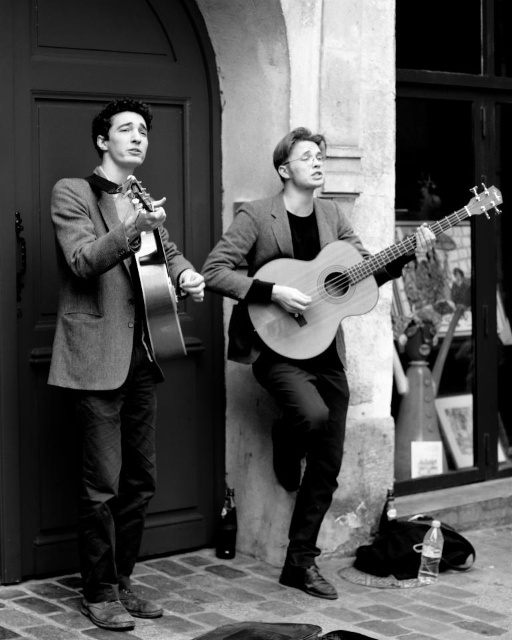
Is point (101, 262) more distant than point (146, 241)?

No.

In the scene shown: Is matte gray blazer at left shorter than matte acoustic guitar at center?

In fact, matte gray blazer at left may be taller than matte acoustic guitar at center.

Does point (147, 371) come closer to viewer compared to point (165, 296)?

That is False.

In order to click on matte gray blazer at left in this screenshot , I will do `click(111, 356)`.

Is wooden acoustic guitar at center positioned behind matte acoustic guitar at center?

Yes.

Does wooden acoustic guitar at center have a greater width compared to matte acoustic guitar at center?

Indeed, wooden acoustic guitar at center has a greater width compared to matte acoustic guitar at center.

This screenshot has height=640, width=512. Identify the location of wooden acoustic guitar at center. (321, 296).

You are a GUI agent. You are given a task and a screenshot of the screen. Output one action in this format:
    pyautogui.click(x=<x>, y=<y>)
    Task: Click on the wooden acoustic guitar at center
    This screenshot has height=640, width=512.
    Given the screenshot: What is the action you would take?
    pyautogui.click(x=321, y=296)

Which is more to the right, matte wood guitar at center or matte acoustic guitar at center?

From the viewer's perspective, matte wood guitar at center appears more on the right side.

Measure the distance between matte wood guitar at center and camera.

matte wood guitar at center is 16.17 feet from camera.

At what (x,y) coordinates should I click in order to perform the action: click on matte wood guitar at center. Please return your answer as a coordinate pair (x, y). The width and height of the screenshot is (512, 640). Looking at the image, I should click on (285, 356).